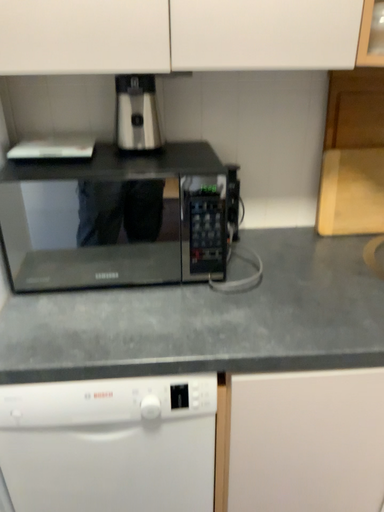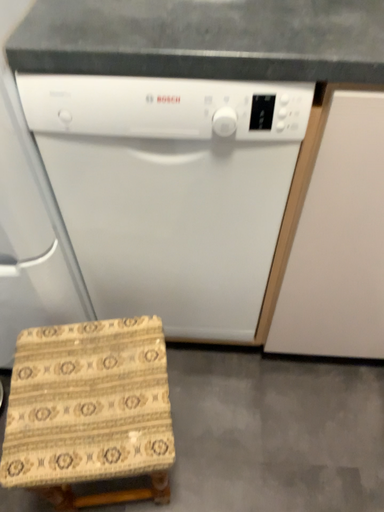
Question: How did the camera likely rotate when shooting the video?

Choices:
 (A) rotated right
 (B) rotated left

Answer: (B)